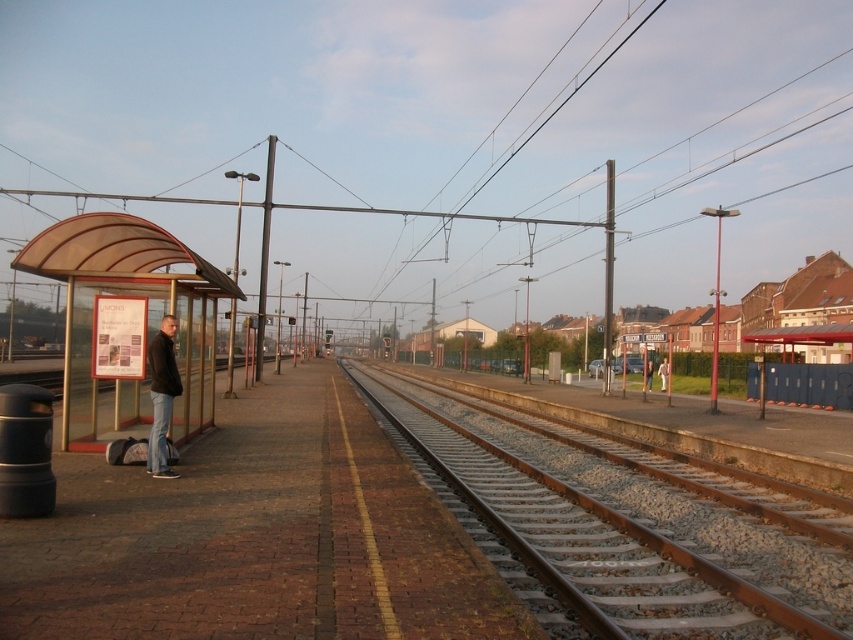
Based on the photo, can you confirm if light brown leather jacket at center is bigger than dark blue jeans at center?

Yes.

Is point (659, 376) positioned after point (647, 364)?

That is True.

The image size is (853, 640). Find the location of `light brown leather jacket at center`. light brown leather jacket at center is located at coordinates (663, 372).

Is transparent plastic bus stop at left positioned in front of dark brown leather jacket at left?

No, transparent plastic bus stop at left is behind dark brown leather jacket at left.

I want to click on transparent plastic bus stop at left, so click(146, 321).

Does transparent plastic bus stop at left come behind dark blue jeans at center?

No, transparent plastic bus stop at left is in front of dark blue jeans at center.

Between transparent plastic bus stop at left and dark blue jeans at center, which one appears on the left side from the viewer's perspective?

Positioned to the left is transparent plastic bus stop at left.

Describe the element at coordinates (146, 321) in the screenshot. I see `transparent plastic bus stop at left` at that location.

The width and height of the screenshot is (853, 640). What are the coordinates of `transparent plastic bus stop at left` in the screenshot? It's located at (146, 321).